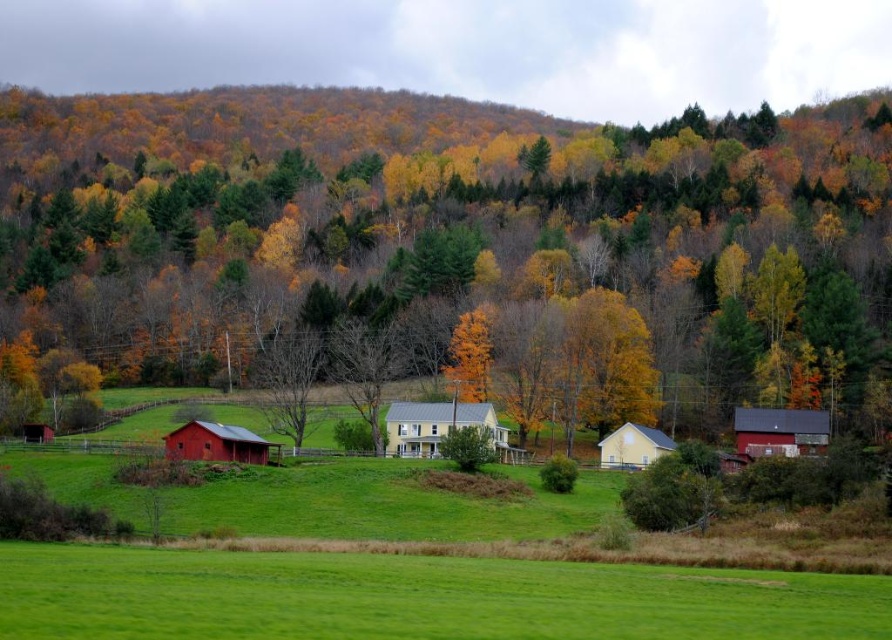
Question: Which of the following is the farthest from the observer?

Choices:
 (A) matte red barn at right
 (B) matte yellow barn at center
 (C) golden yellow leaves at center

Answer: (C)

Question: Observing the image, what is the correct spatial positioning of yellow matte house at center in reference to matte red barn at lower left?

Choices:
 (A) below
 (B) above

Answer: (B)

Question: Which point is farther to the camera?

Choices:
 (A) matte yellow barn at center
 (B) matte yellow tree at center

Answer: (B)

Question: Is yellow matte house at center to the left of matte red barn at right from the viewer's perspective?

Choices:
 (A) no
 (B) yes

Answer: (B)

Question: Is matte red barn at right in front of golden yellow leaves at center?

Choices:
 (A) no
 (B) yes

Answer: (B)

Question: Based on their relative distances, which object is farther from the matte yellow barn at center?

Choices:
 (A) matte red barn at right
 (B) yellow matte house at center
 (C) matte red barn at lower left

Answer: (C)